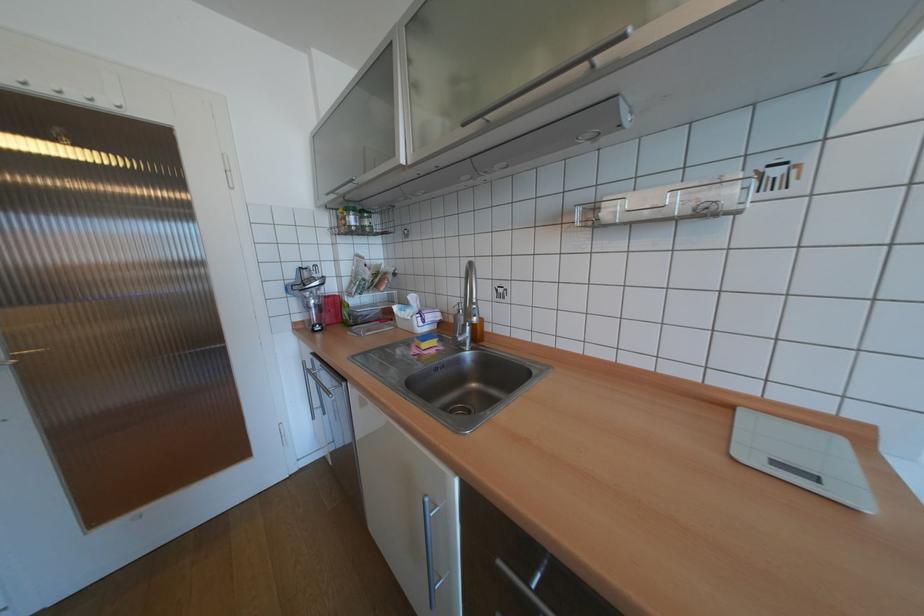
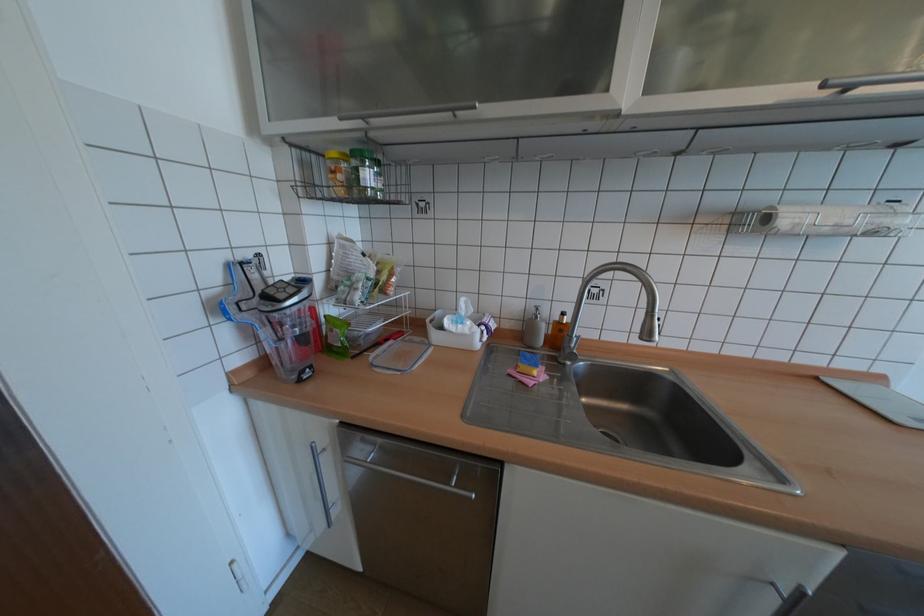
Find the pixel in the second image that matches pixel 468 312 in the first image.

(545, 317)